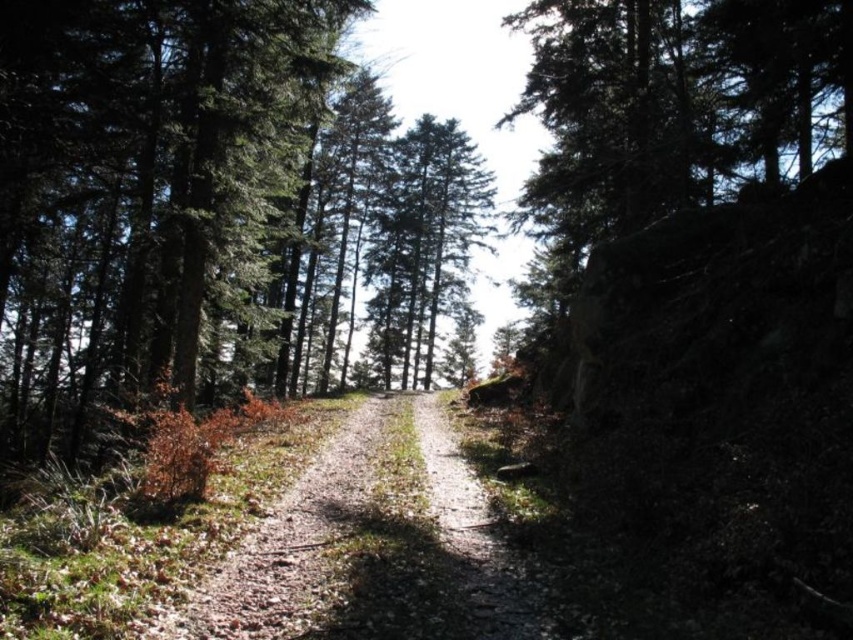
Which is below, green textured tree at center or dusty gravel path at center?

dusty gravel path at center is below.

Who is more forward, (341, 131) or (380, 534)?

Point (380, 534) is in front.

Locate an element on the screen. Image resolution: width=853 pixels, height=640 pixels. green textured tree at center is located at coordinates (212, 214).